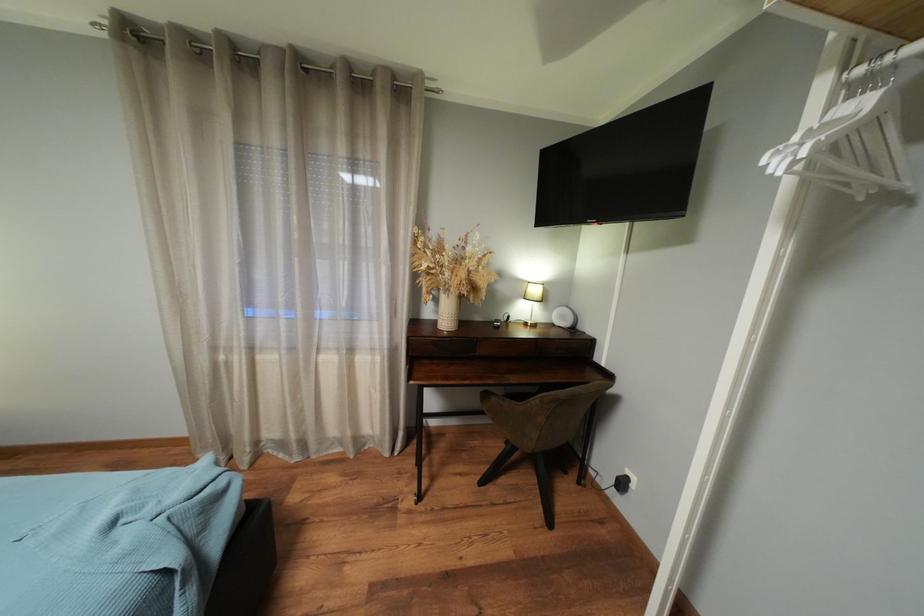
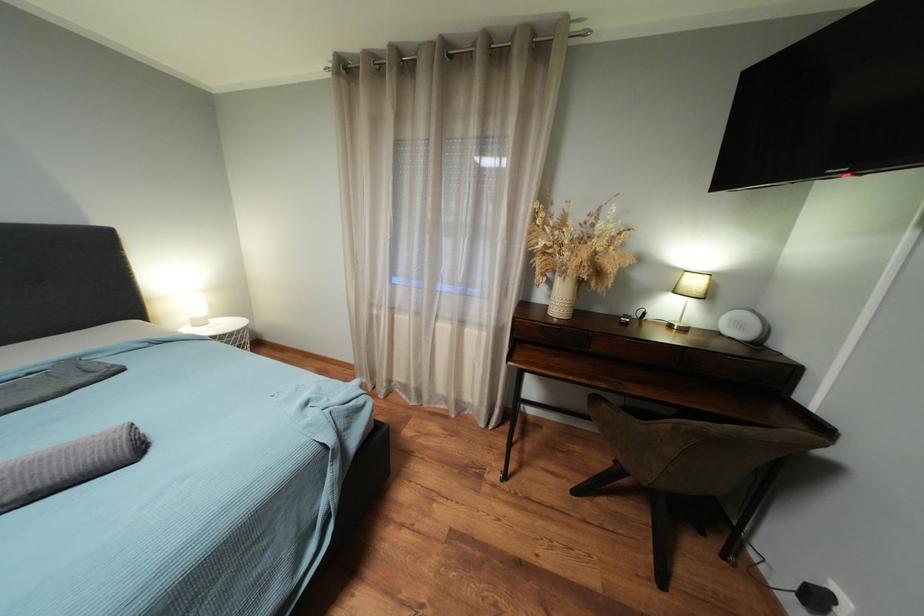
Question: The camera is either moving clockwise (left) or counter-clockwise (right) around the object. The first image is from the beginning of the video and the second image is from the end. Is the camera moving left or right when shooting the video?

Choices:
 (A) Left
 (B) Right

Answer: (B)